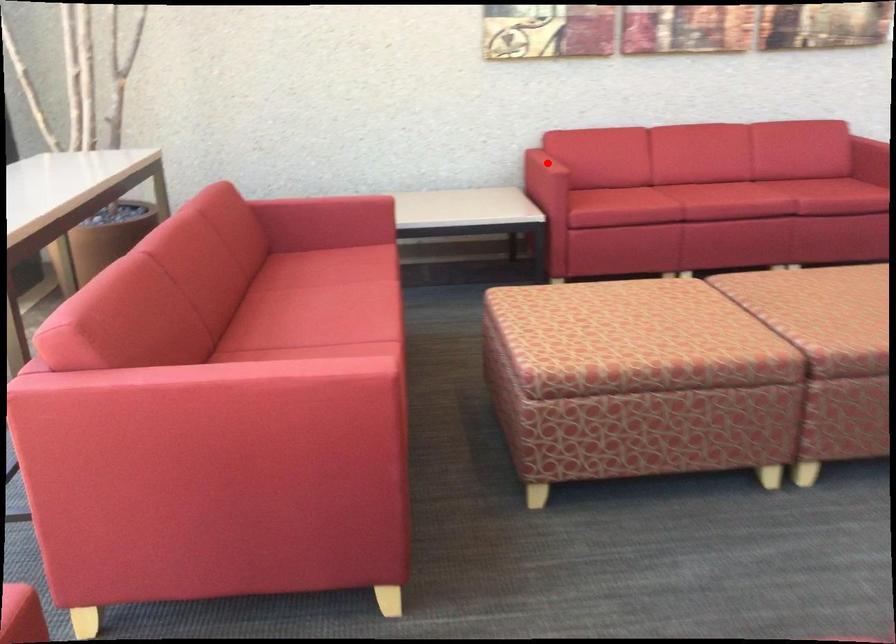
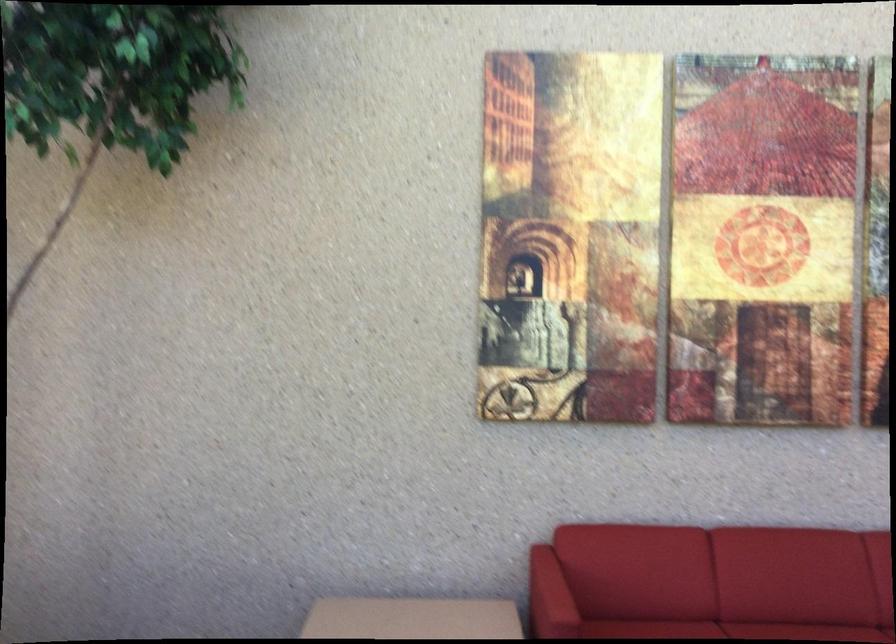
The point at the highlighted location is marked in the first image. Where is the corresponding point in the second image?

(549, 597)